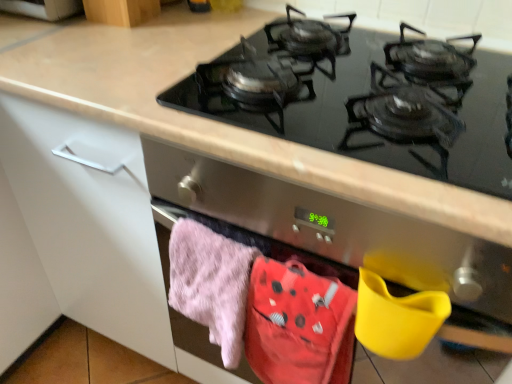
Where is `wooden cabinet at upper left`? This screenshot has width=512, height=384. wooden cabinet at upper left is located at coordinates (121, 11).

The height and width of the screenshot is (384, 512). I want to click on stainless steel oven at center, so click(347, 237).

Describe the element at coordinates (211, 284) in the screenshot. I see `fluffy pink towel at lower left` at that location.

Measure the distance between fluffy cotton towel at lower center and camera.

fluffy cotton towel at lower center is 23.64 inches from camera.

The height and width of the screenshot is (384, 512). I want to click on wooden cabinet at upper left, so click(x=121, y=11).

From a real-world perspective, is black glass gas stove at upper center positioned under fluffy cotton towel at lower center based on gravity?

Incorrect, from a real-world perspective, black glass gas stove at upper center is higher than fluffy cotton towel at lower center.

From the image's perspective, relative to fluffy cotton towel at lower center, is black glass gas stove at upper center above or below?

Clearly, from the image's perspective, black glass gas stove at upper center is above fluffy cotton towel at lower center.

In the scene shown: Can you confirm if black glass gas stove at upper center is taller than fluffy cotton towel at lower center?

In fact, black glass gas stove at upper center may be shorter than fluffy cotton towel at lower center.

Considering their positions, is black glass gas stove at upper center located in front of or behind fluffy cotton towel at lower center?

black glass gas stove at upper center is positioned closer to the viewer than fluffy cotton towel at lower center.

Are fluffy cotton towel at lower center and stainless steel oven at center beside each other?

There is a gap between fluffy cotton towel at lower center and stainless steel oven at center.

Is point (303, 375) closer to viewer compared to point (332, 227)?

No.

From a real-world perspective, is fluffy cotton towel at lower center located beneath stainless steel oven at center?

Yes, from a real-world perspective, fluffy cotton towel at lower center is under stainless steel oven at center.

From the picture: How different are the orientations of fluffy cotton towel at lower center and stainless steel oven at center in degrees?

2.53 degrees.

From the image's perspective, is stainless steel oven at center beneath black glass gas stove at upper center?

Indeed, from the image's perspective, stainless steel oven at center is shown beneath black glass gas stove at upper center.

This screenshot has width=512, height=384. Find the location of `oven that is in front of the black glass gas stove at upper center`. oven that is in front of the black glass gas stove at upper center is located at coordinates (347, 237).

Is stainless steel oven at center touching black glass gas stove at upper center?

No, stainless steel oven at center is not next to black glass gas stove at upper center.

Can you tell me how much stainless steel oven at center and black glass gas stove at upper center differ in facing direction?

The angular difference between stainless steel oven at center and black glass gas stove at upper center is 1.13 degrees.

Is point (211, 329) positioned after point (289, 270)?

Yes.

Is fluffy pink towel at lower left shorter than fluffy cotton towel at lower center?

Indeed, fluffy pink towel at lower left has a lesser height compared to fluffy cotton towel at lower center.

Would you consider fluffy pink towel at lower left to be distant from fluffy cotton towel at lower center?

They are positioned close to each other.

Is the depth of fluffy pink towel at lower left greater than that of fluffy cotton towel at lower center?

Yes, it is.

Looking at the image, does stainless steel oven at center seem bigger or smaller compared to wooden cabinet at upper left?

stainless steel oven at center is bigger than wooden cabinet at upper left.

How far apart are stainless steel oven at center and wooden cabinet at upper left?

stainless steel oven at center and wooden cabinet at upper left are 23.67 inches apart from each other.

Which of these two, stainless steel oven at center or wooden cabinet at upper left, is thinner?

Thinner between the two is wooden cabinet at upper left.

Is stainless steel oven at center in contact with wooden cabinet at upper left?

No, stainless steel oven at center is not beside wooden cabinet at upper left.

Between stainless steel oven at center and fluffy cotton towel at lower center, which one has less height?

With less height is fluffy cotton towel at lower center.

From the picture: Considering the relative positions of stainless steel oven at center and fluffy cotton towel at lower center in the image provided, is stainless steel oven at center behind fluffy cotton towel at lower center?

No, stainless steel oven at center is in front of fluffy cotton towel at lower center.

Between stainless steel oven at center and fluffy cotton towel at lower center, which one appears on the right side from the viewer's perspective?

From the viewer's perspective, stainless steel oven at center appears more on the right side.

Find the location of a particular element. clothing in front of the wooden cabinet at upper left is located at coordinates (298, 325).

Is the position of wooden cabinet at upper left less distant than that of fluffy cotton towel at lower center?

No, wooden cabinet at upper left is further to the viewer.

From the image's perspective, between wooden cabinet at upper left and fluffy cotton towel at lower center, which one is located above?

wooden cabinet at upper left.

Considering the relative sizes of wooden cabinet at upper left and fluffy cotton towel at lower center in the image provided, is wooden cabinet at upper left wider than fluffy cotton towel at lower center?

Yes.

The image size is (512, 384). Identify the location of gas stove positioned vertically above the fluffy cotton towel at lower center (from a real-world perspective). (367, 99).

Locate an element on the screen. oven located in front of the fluffy cotton towel at lower center is located at coordinates (347, 237).

Considering their positions, is fluffy cotton towel at lower center positioned further to wooden cabinet at upper left than stainless steel oven at center?

fluffy cotton towel at lower center.

From the image, which object appears to be nearer to fluffy pink towel at lower left, fluffy cotton towel at lower center or black glass gas stove at upper center?

fluffy cotton towel at lower center is closer to fluffy pink towel at lower left.

Considering their positions, is black glass gas stove at upper center positioned closer to wooden cabinet at upper left than fluffy cotton towel at lower center?

Among the two, black glass gas stove at upper center is located nearer to wooden cabinet at upper left.

Based on the photo, from the image, which object appears to be nearer to stainless steel oven at center, fluffy cotton towel at lower center or fluffy pink towel at lower left?

fluffy cotton towel at lower center lies closer to stainless steel oven at center than the other object.

Based on their spatial positions, is black glass gas stove at upper center or fluffy pink towel at lower left closer to wooden cabinet at upper left?

black glass gas stove at upper center is closer to wooden cabinet at upper left.

Based on their spatial positions, is wooden cabinet at upper left or black glass gas stove at upper center further from fluffy pink towel at lower left?

wooden cabinet at upper left lies further to fluffy pink towel at lower left than the other object.

When comparing their distances from stainless steel oven at center, does black glass gas stove at upper center or wooden cabinet at upper left seem further?

wooden cabinet at upper left.

From the image, which object appears to be nearer to fluffy pink towel at lower left, wooden cabinet at upper left or fluffy cotton towel at lower center?

Among the two, fluffy cotton towel at lower center is located nearer to fluffy pink towel at lower left.

Where is `gas stove between wooden cabinet at upper left and fluffy pink towel at lower left from top to bottom`? The image size is (512, 384). gas stove between wooden cabinet at upper left and fluffy pink towel at lower left from top to bottom is located at coordinates (367, 99).

At what (x,y) coordinates should I click in order to perform the action: click on gas stove between wooden cabinet at upper left and fluffy cotton towel at lower center in the up-down direction. Please return your answer as a coordinate pair (x, y). Looking at the image, I should click on (367, 99).

At what (x,y) coordinates should I click in order to perform the action: click on beach towel between black glass gas stove at upper center and fluffy cotton towel at lower center in the up-down direction. Please return your answer as a coordinate pair (x, y). Looking at the image, I should click on (211, 284).

Image resolution: width=512 pixels, height=384 pixels. I want to click on gas stove located between wooden cabinet at upper left and stainless steel oven at center in the left-right direction, so click(367, 99).